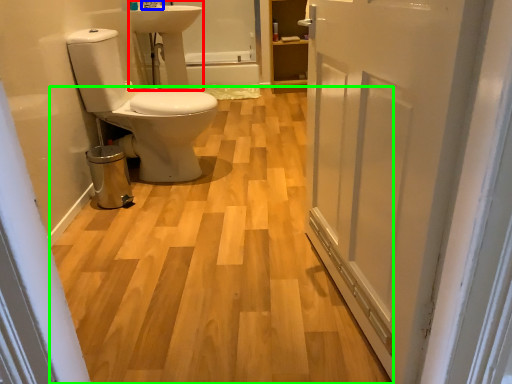
Question: Which object is positioned closest to sink (highlighted by a red box)? Select from tap (highlighted by a blue box) and plain (highlighted by a green box).

Choices:
 (A) tap
 (B) plain

Answer: (A)